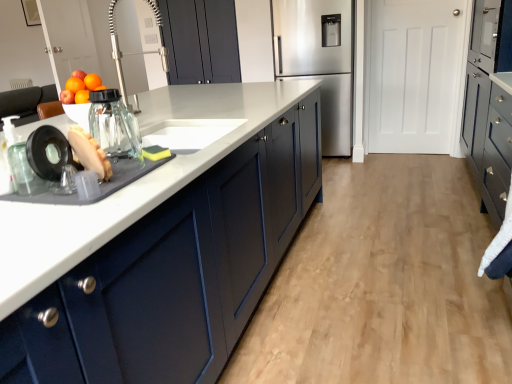
Find the location of a particular element. The width and height of the screenshot is (512, 384). vacant area that is in front of yellow sponge at sink, which is the 1th food from back to front is located at coordinates (138, 160).